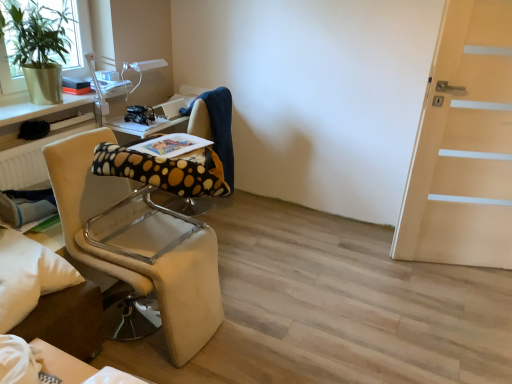
Question: Would you say green matte plant at upper left is to the left or to the right of light wood door at right in the picture?

Choices:
 (A) left
 (B) right

Answer: (A)

Question: Based on their sizes in the image, would you say green matte plant at upper left is bigger or smaller than light wood door at right?

Choices:
 (A) small
 (B) big

Answer: (A)

Question: Which object is positioned closest to the green matte plant at upper left?

Choices:
 (A) metallic silver table at upper left
 (B) white soft pillow at lower left
 (C) light wood door at right
 (D) beige fabric chair at left
 (E) black plastic headphones at center

Answer: (A)

Question: Which of these objects is positioned closest to the metallic silver table at upper left?

Choices:
 (A) black plastic headphones at center
 (B) green matte plant at upper left
 (C) light wood door at right
 (D) polka dot fabric computer chair at center
 (E) white soft pillow at lower left

Answer: (B)